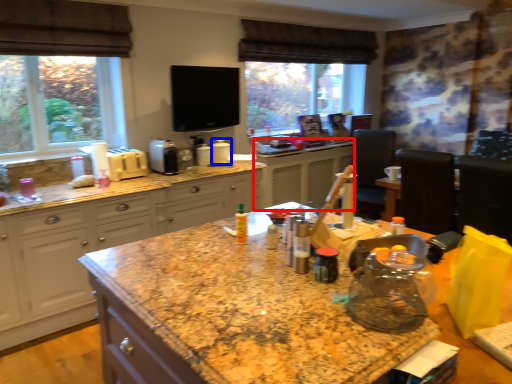
Question: Which object appears farthest to the camera in this image, counter (highlighted by a red box) or appliance (highlighted by a blue box)?

Choices:
 (A) counter
 (B) appliance

Answer: (A)